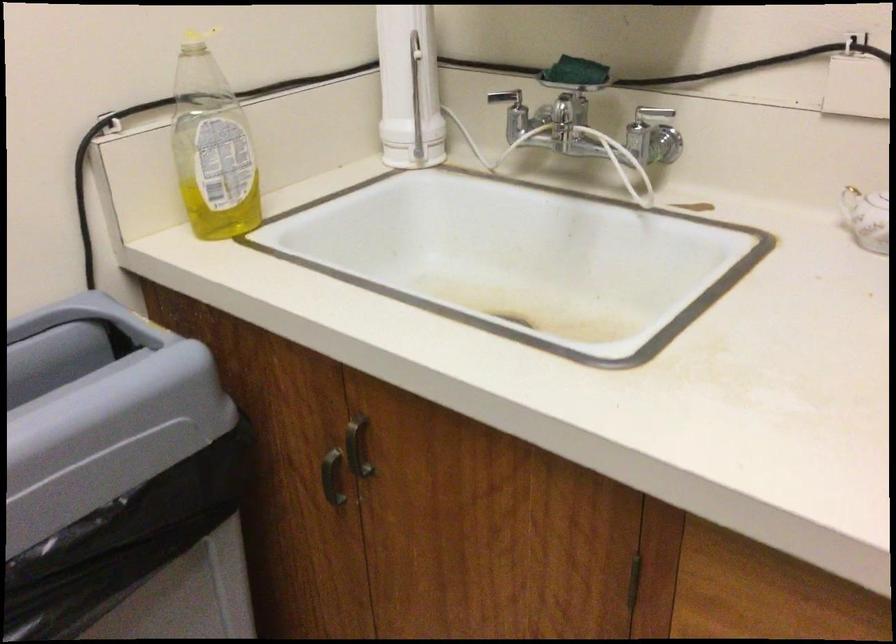
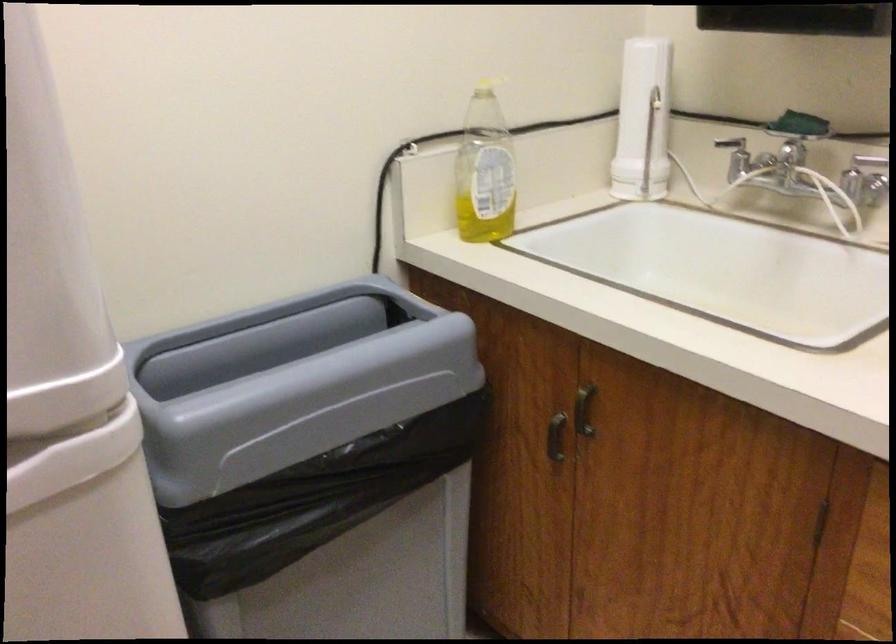
Question: How did the camera likely rotate?

Choices:
 (A) Left
 (B) Right
 (C) Up
 (D) Down

Answer: (A)